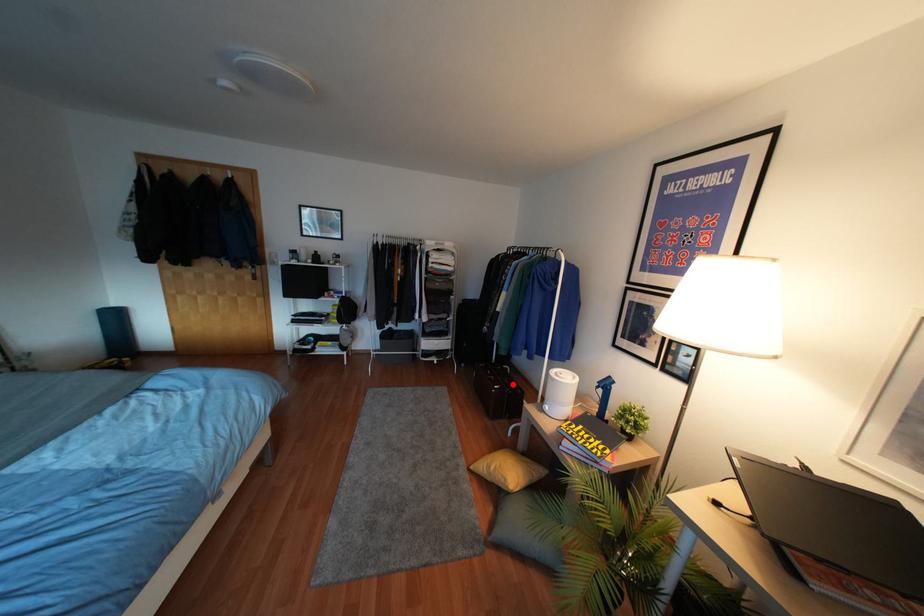
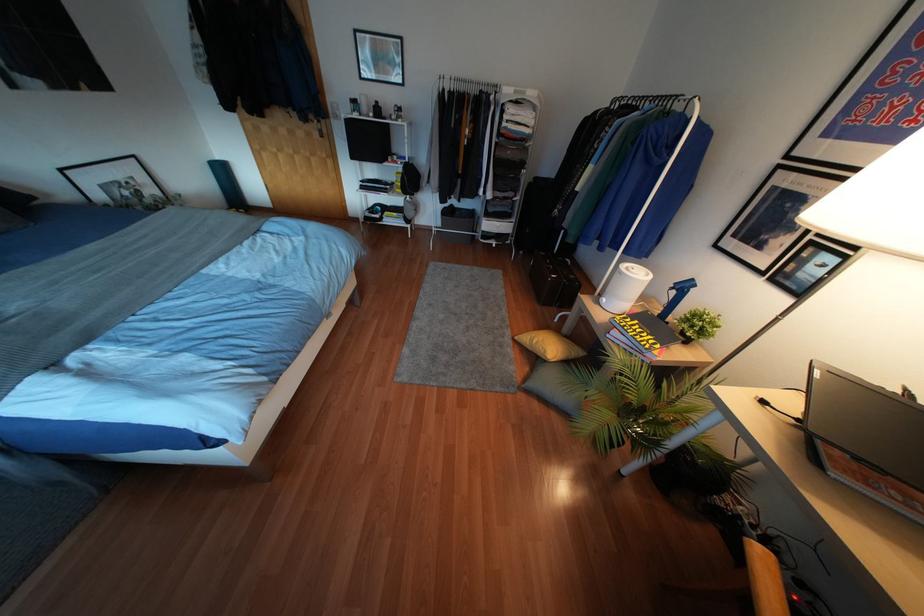
Where in the second image is the point corresponding to the highlighted location from the first image?

(572, 277)